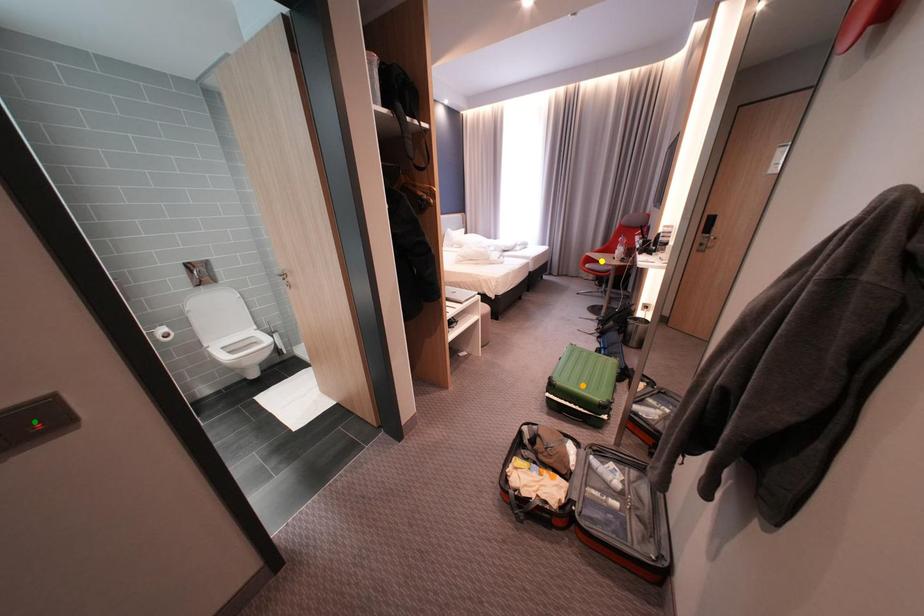
Order these from farthest to nearest:
orange point | green point | yellow point

yellow point, orange point, green point